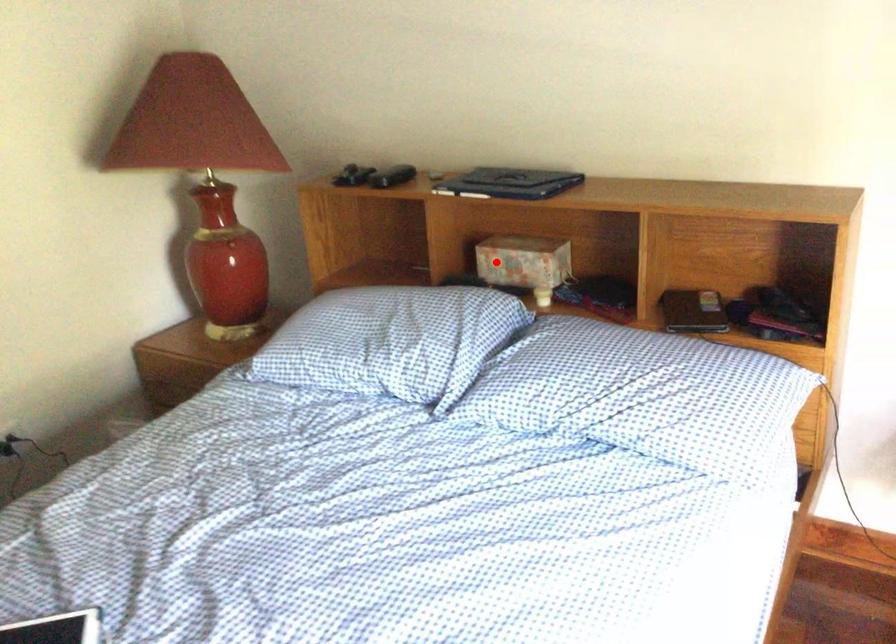
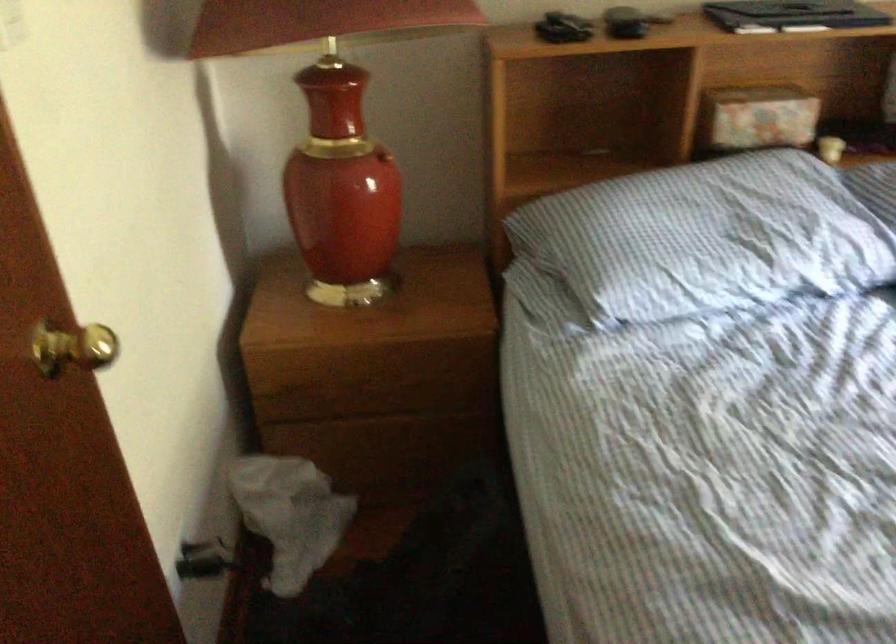
Find the pixel in the second image that matches the highlighted location in the first image.

(757, 118)